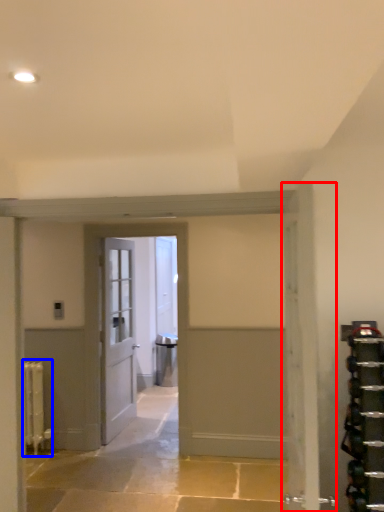
Question: Which point is closer to the camera, door (highlighted by a red box) or radiator (highlighted by a blue box)?

Choices:
 (A) door
 (B) radiator

Answer: (A)